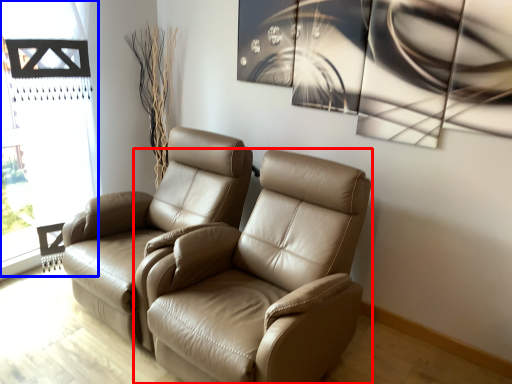
Question: Which object is further to the camera taking this photo, chair (highlighted by a red box) or window frame (highlighted by a blue box)?

Choices:
 (A) chair
 (B) window frame

Answer: (B)